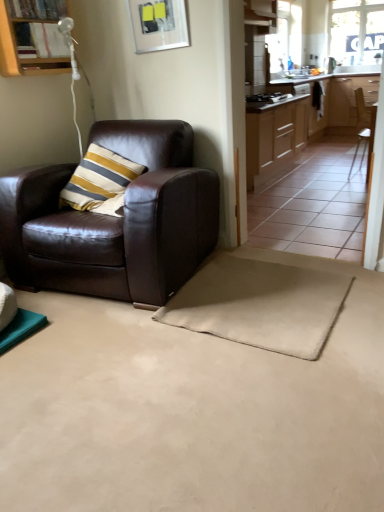
Question: From a real-world perspective, relative to wooden cabinet at upper left, which appears as the 1th cabinetry when viewed from the front, is metallic silver picture frame at upper center vertically above or below?

Choices:
 (A) above
 (B) below

Answer: (A)

Question: Is metallic silver picture frame at upper center situated inside wooden cabinet at upper left, the third cabinetry when ordered from back to front, or outside?

Choices:
 (A) outside
 (B) inside

Answer: (A)

Question: Which object is the closest to the white glossy sink at upper center?

Choices:
 (A) brown leather chair at right, which is counted as the 2th chair, starting from the bottom
 (B) transparent glass window at upper right
 (C) shiny brown leather armchair at left, which appears as the 1th chair when viewed from the left
 (D) light wood cabinetry at center, which ranks as the third cabinetry in left-to-right order
 (E) beige suede yoga mat at lower center

Answer: (D)

Question: Which object is positioned closest to the white glossy sink at upper center?

Choices:
 (A) wooden cabinet at upper left, the third cabinetry when ordered from back to front
 (B) light wood cabinetry at center, the first cabinetry when ordered from right to left
 (C) beige suede yoga mat at lower center
 (D) wooden cabinet at center, arranged as the second cabinetry when viewed from the front
 (E) shiny brown leather armchair at left, placed as the second chair when sorted from top to bottom

Answer: (B)